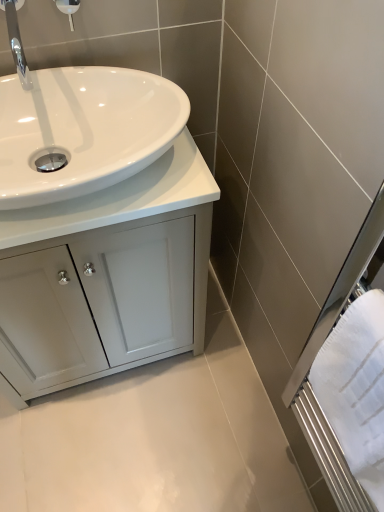
Question: From a real-world perspective, is white textured towel at right positioned above or below white glossy countertop at center?

Choices:
 (A) below
 (B) above

Answer: (A)

Question: Considering the positions of white textured towel at right and white glossy countertop at center in the image, is white textured towel at right bigger or smaller than white glossy countertop at center?

Choices:
 (A) small
 (B) big

Answer: (A)

Question: Which of these objects is positioned closest to the white glossy countertop at center?

Choices:
 (A) white glossy cabinet at lower left
 (B) white textured towel at right
 (C) white glossy shower head at upper left
 (D) polished chrome faucet at upper left

Answer: (A)

Question: Which object is the farthest from the white glossy countertop at center?

Choices:
 (A) white glossy cabinet at lower left
 (B) polished chrome faucet at upper left
 (C) white textured towel at right
 (D) white glossy shower head at upper left

Answer: (C)